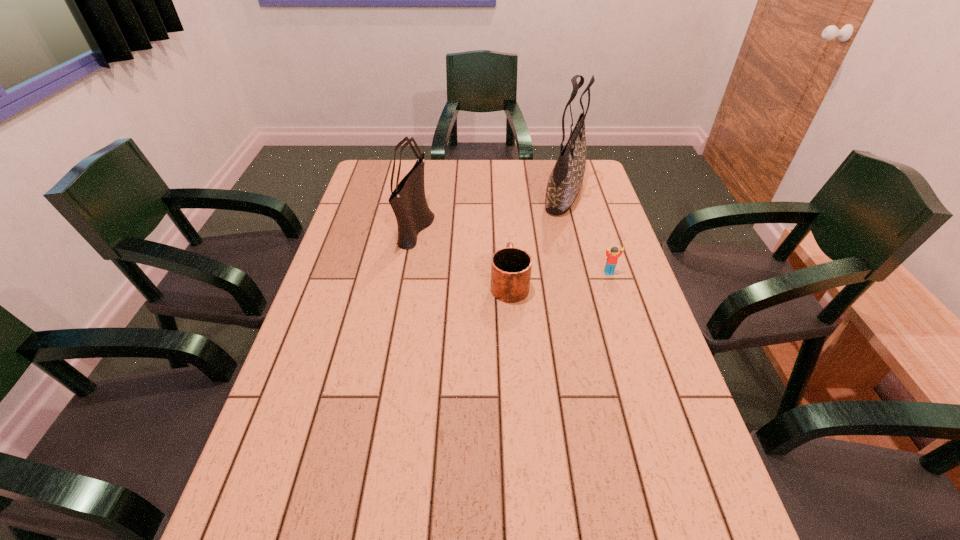
Where is `free space located 0.190m on the face of the Lego`? The width and height of the screenshot is (960, 540). free space located 0.190m on the face of the Lego is located at coordinates tap(626, 325).

This screenshot has width=960, height=540. In order to click on object located in the far edge section of the desktop in this screenshot , I will do `click(564, 184)`.

The image size is (960, 540). In order to click on tote bag that is at the right edge in this screenshot , I will do `click(564, 184)`.

At what (x,y) coordinates should I click in order to perform the action: click on Lego that is at the right edge. Please return your answer as a coordinate pair (x, y). Looking at the image, I should click on pyautogui.click(x=612, y=257).

At what (x,y) coordinates should I click in order to perform the action: click on object present at the far right corner. Please return your answer as a coordinate pair (x, y). This screenshot has width=960, height=540. Looking at the image, I should click on (564, 184).

In the image, there is a desktop. Identify the location of vacant area at the far edge. The height and width of the screenshot is (540, 960). (531, 184).

Locate an element on the screen. free space at the left edge is located at coordinates (304, 408).

In the image, there is a desktop. Identify the location of blank space at the right edge. The image size is (960, 540). (642, 376).

Image resolution: width=960 pixels, height=540 pixels. In the image, there is a desktop. What are the coordinates of `free space at the far left corner` in the screenshot? It's located at coord(385,179).

Identify the location of empty space that is in between the tallest object and the second tallest object. The width and height of the screenshot is (960, 540). (491, 210).